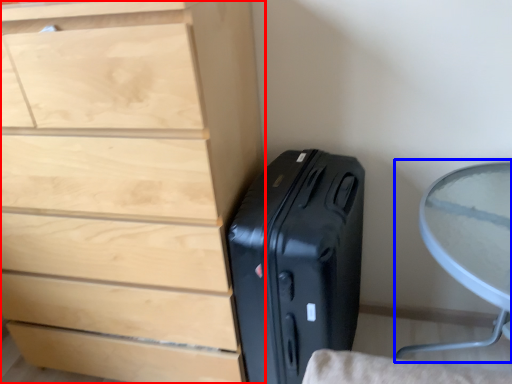
Question: Which object is further to the camera taking this photo, chest of drawers (highlighted by a red box) or round table (highlighted by a blue box)?

Choices:
 (A) chest of drawers
 (B) round table

Answer: (A)